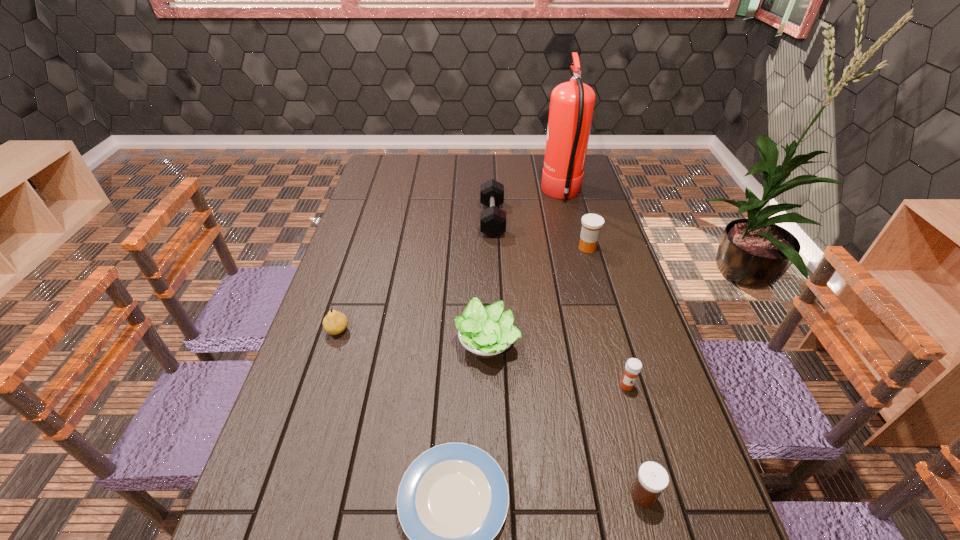
The width and height of the screenshot is (960, 540). Identify the location of free spot between the nearest medicine and the fire extinguisher. (603, 345).

The width and height of the screenshot is (960, 540). In order to click on vacant area between the lettuce and the sixth nearest object in this screenshot , I will do `click(538, 295)`.

Identify the location of vacant area between the pear and the lettuce. This screenshot has height=540, width=960. (412, 337).

Locate which object ranks sixth in proximity to the shortest object. Please provide its 2D coordinates. Your answer should be formatted as a tuple, i.e. [(x, y)], where the tuple contains the x and y coordinates of a point satisfying the conditions above.

[(492, 220)]

Choose which object is the fourth nearest neighbor to the fire extinguisher. Please provide its 2D coordinates. Your answer should be formatted as a tuple, i.e. [(x, y)], where the tuple contains the x and y coordinates of a point satisfying the conditions above.

[(633, 366)]

Image resolution: width=960 pixels, height=540 pixels. I want to click on medicine that is the third nearest to the lettuce, so click(591, 223).

Point out which medicine is positioned as the nearest to the plate. Please provide its 2D coordinates. Your answer should be formatted as a tuple, i.e. [(x, y)], where the tuple contains the x and y coordinates of a point satisfying the conditions above.

[(652, 479)]

Locate an element on the screen. The image size is (960, 540). vacant area in the image that satisfies the following two spatial constraints: 1. on the label of the tallest medicine; 2. on the front side of the nearest medicine is located at coordinates (660, 495).